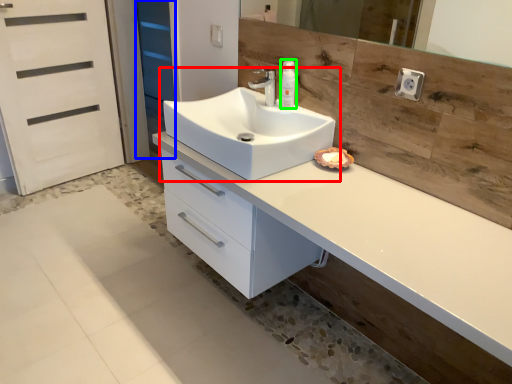
Question: Which object is the closest to the sink (highlighted by a red box)? Choose among these: screen door (highlighted by a blue box) or soap dispenser (highlighted by a green box).

Choices:
 (A) screen door
 (B) soap dispenser

Answer: (B)